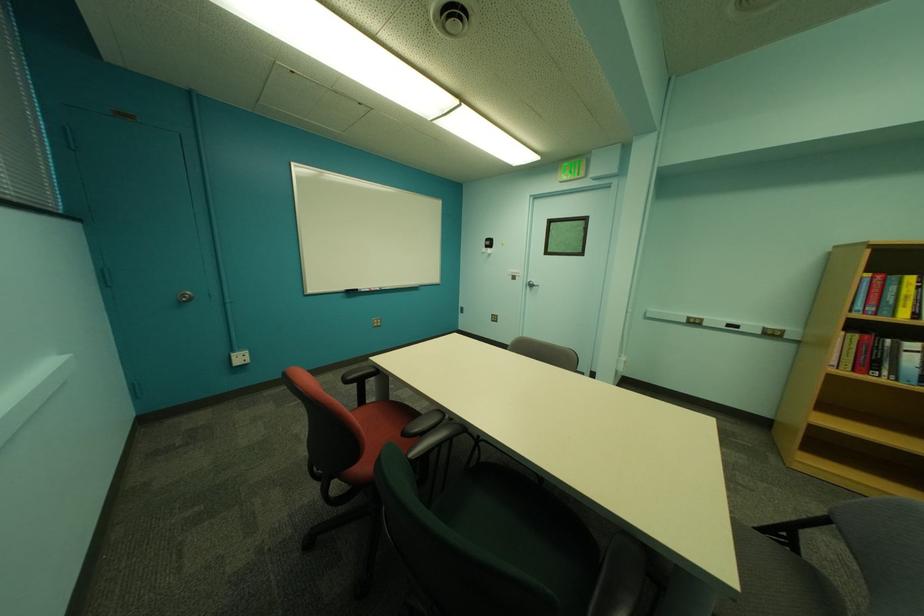
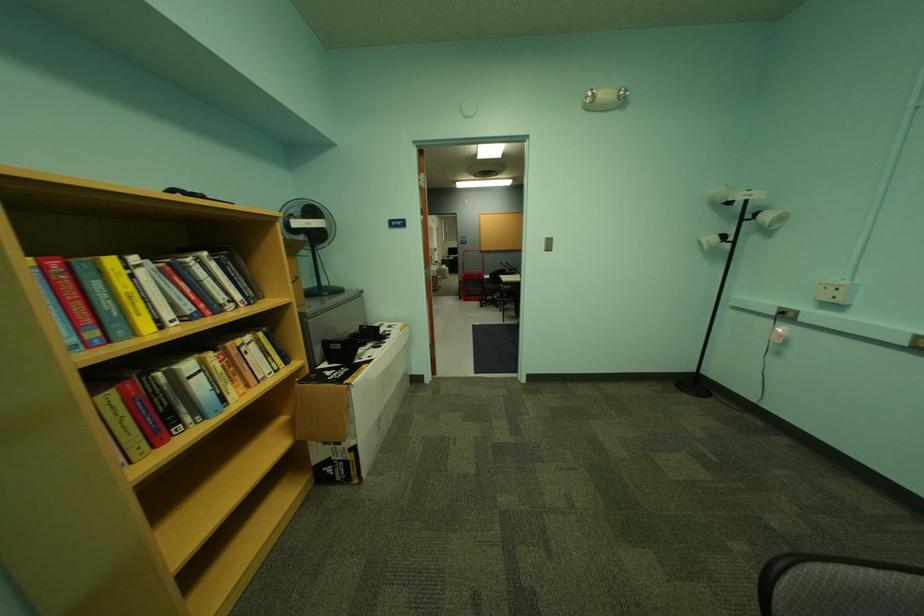
Where in the second image is the point corresponding to [881,310] from the first image?

(103, 334)